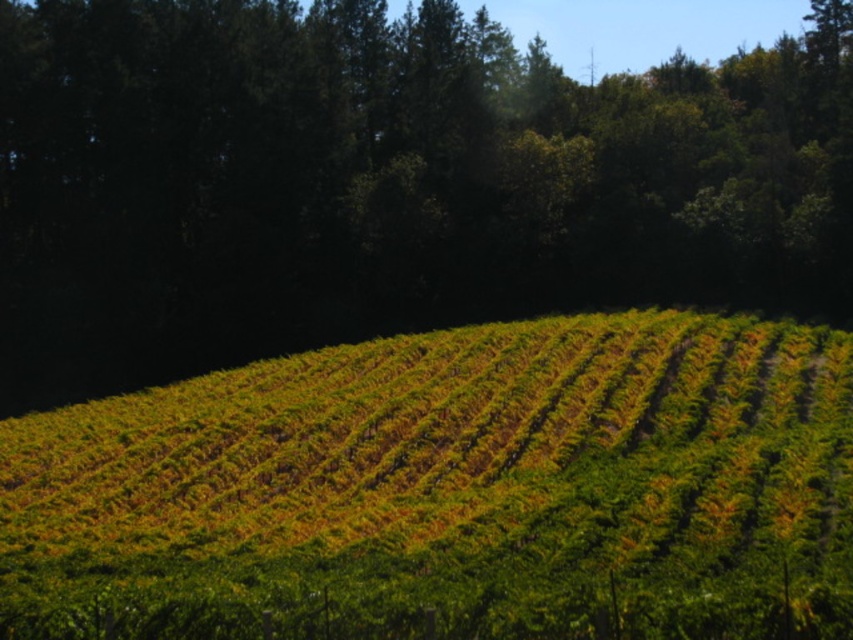
Question: Among these objects, which one is farthest from the camera?

Choices:
 (A) green leafy hillside at center
 (B) green leafy tree at center

Answer: (B)

Question: Does green leafy tree at center appear on the right side of green leafy hillside at center?

Choices:
 (A) yes
 (B) no

Answer: (A)

Question: Where is green leafy tree at center located in relation to green leafy hillside at center in the image?

Choices:
 (A) left
 (B) right

Answer: (B)

Question: Can you confirm if green leafy tree at center is positioned to the left of green leafy hillside at center?

Choices:
 (A) no
 (B) yes

Answer: (A)

Question: Among these points, which one is nearest to the camera?

Choices:
 (A) (312, 570)
 (B) (683, 113)

Answer: (A)

Question: Which of the following is the farthest from the observer?

Choices:
 (A) green leafy tree at center
 (B) green leafy hillside at center

Answer: (A)